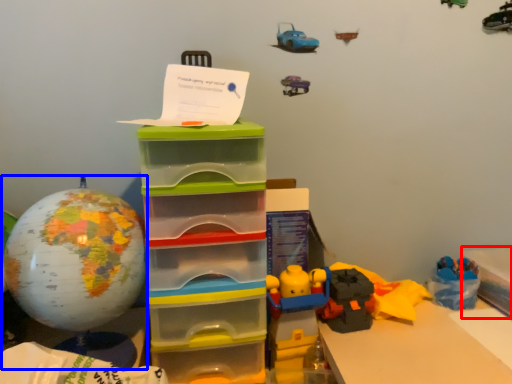
Question: Among these objects, which one is farthest to the camera, storage box (highlighted by a red box) or toy (highlighted by a blue box)?

Choices:
 (A) storage box
 (B) toy

Answer: (A)